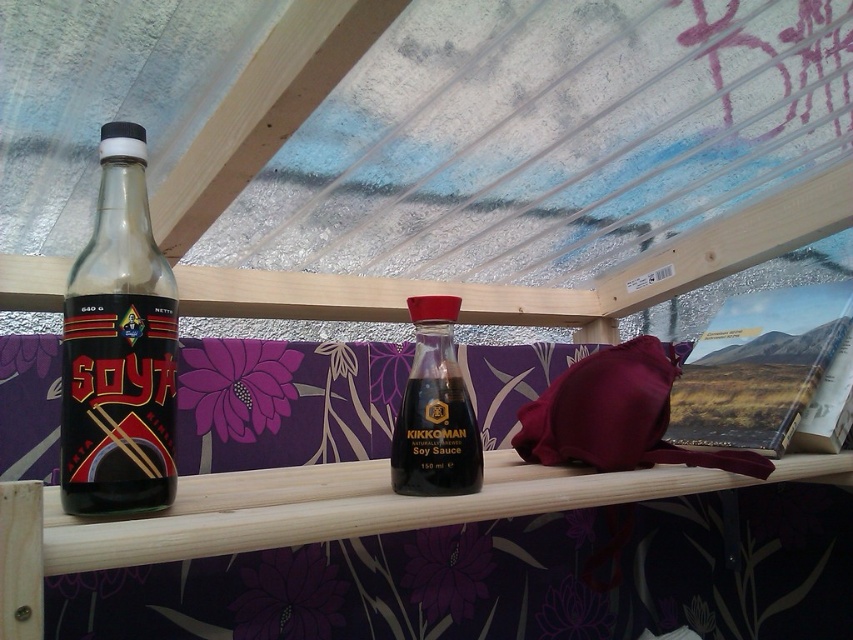
You are setting up a small table for a picnic in the greenhouse. You have a matte glass soy sauce bottle at left and a dark brown glass bottle at center. Which bottle should you place closer to the edge of the table to ensure sunlight reaches both equally?

The matte glass soy sauce bottle at left should be placed closer to the edge of the table since it is positioned to the left of the dark brown glass bottle at center, allowing sunlight to reach both equally by balancing their positions relative to the light source.

You are a chef standing at the shelf and need to grab the soy sauce bottle. The shelf is 1.2 meters away from you. Can you reach the matte glass soy sauce bottle at left without moving closer?

The matte glass soy sauce bottle at left is 44.20 centimeters from the camera, which is within the 1.2 meters distance. Therefore, you can reach it without moving closer.

You are a chef preparing a dish and need to pour soy sauce from one container to another. You have a matte glass soy sauce bottle at left and a dark brown glass bottle at center. Which bottle has a wider opening to accommodate a steady pour?

The matte glass soy sauce bottle at left has a larger width than the dark brown glass bottle at center, so it has a wider opening for a steady pour.